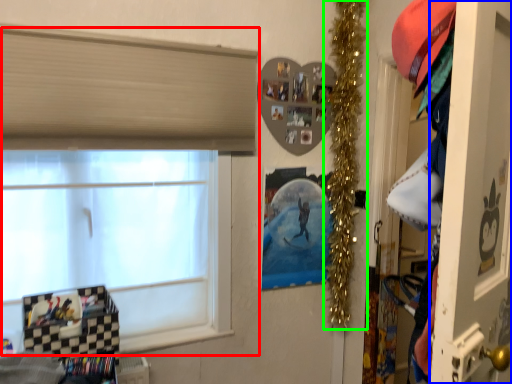
Question: Considering the real-world distances, which object is farthest from window (highlighted by a red box)? screen door (highlighted by a blue box) or christmas decoration (highlighted by a green box)?

Choices:
 (A) screen door
 (B) christmas decoration

Answer: (A)